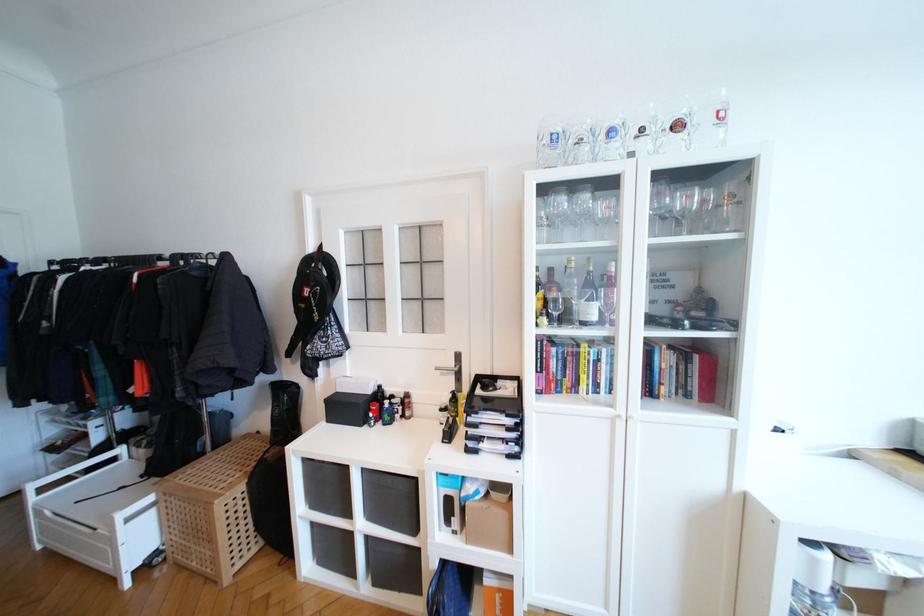
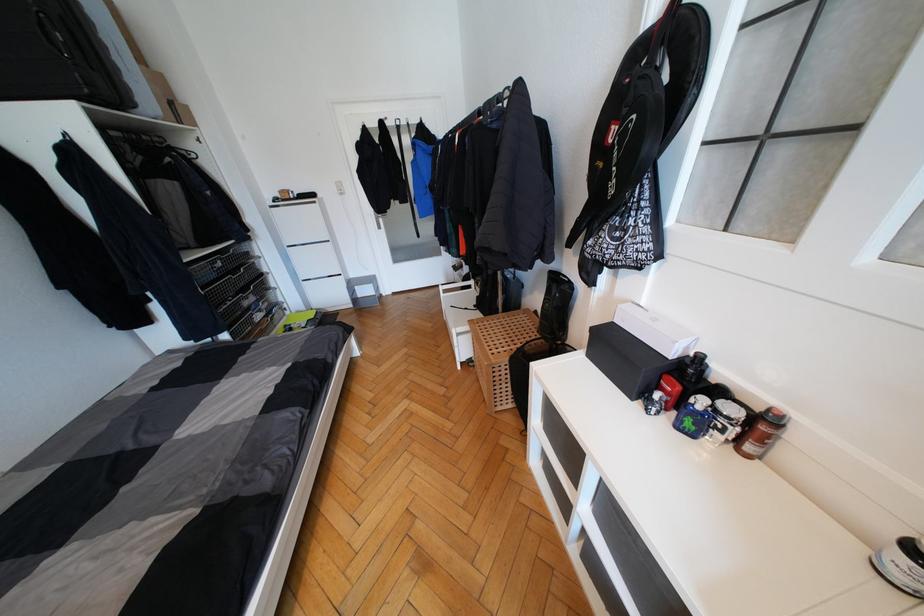
Question: A red point is marked in image1. In image2, is the corresponding 3D point closer to the camera or farther? Reply with the corresponding letter.

Choices:
 (A) The corresponding 3D point is closer.
 (B) The corresponding 3D point is farther.

Answer: (A)